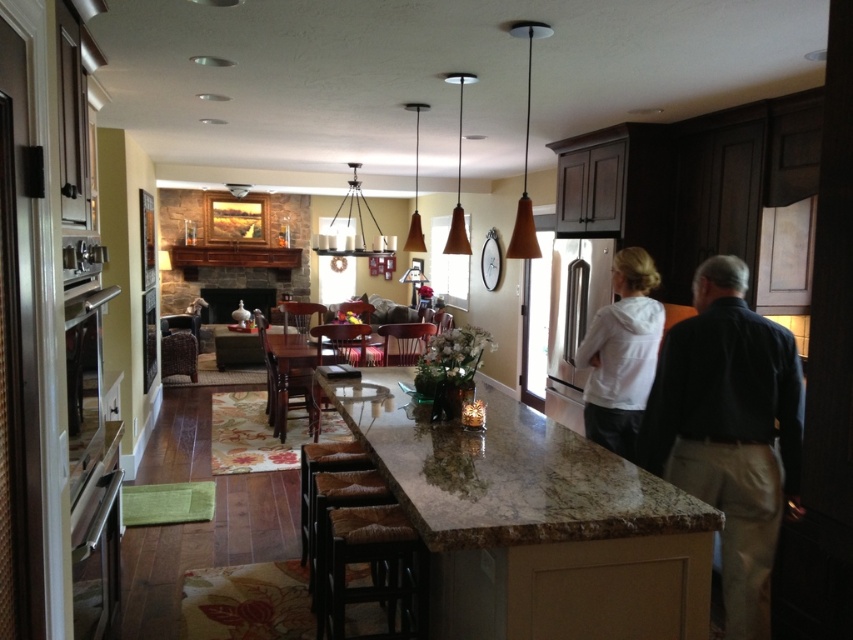
You are a delivery person who just arrived at the house. You need to place a package that is 30 inches long on the marble countertop at center or the white matte hoodie at center. Which surface can the package fit on without overhanging?

The marble countertop at center is 30.01 inches from the white matte hoodie at center, so the distance between them is just over 30 inches. However, the question is about the length of the package fitting on a single surface. Since the package is 30 inches long, it can fit on the marble countertop at center if its length is at least 30 inches. However, the description only provides the distance between the two objects, not the dimensions of the surfaces themselves. Therefore, based on the given information,

You are a chef preparing a meal and need to place a 24 inch cutting board on the marble countertop at center. Considering the dark blue shirt at center is already on the countertop, will the cutting board fit without overlapping the shirt?

The marble countertop at center is 28.33 inches from the dark blue shirt at center. Since the cutting board is 24 inches long, it can fit on the marble countertop at center as long as it is placed away from the dark blue shirt at center to avoid overlapping.